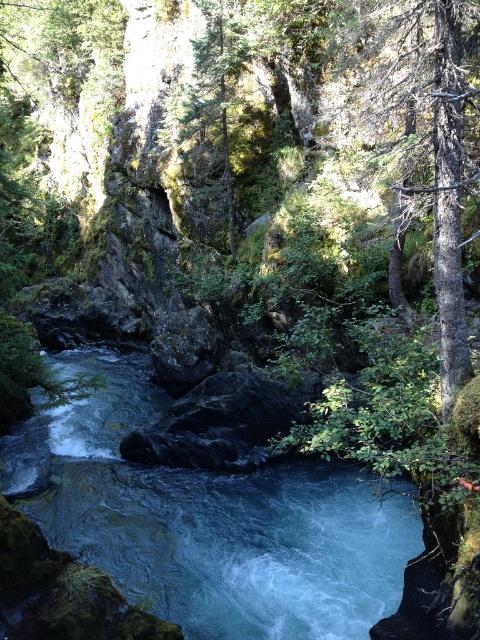
Question: Which of the following is the farthest from the observer?

Choices:
 (A) blue smooth water at center
 (B) green mossy rock at upper center
 (C) smooth bark tree at right

Answer: (B)

Question: Can you confirm if blue smooth water at center is positioned to the left of green mossy rock at upper center?

Choices:
 (A) no
 (B) yes

Answer: (B)

Question: Which object is positioned closest to the green mossy rock at upper center?

Choices:
 (A) smooth bark tree at right
 (B) blue smooth water at center

Answer: (A)

Question: Is blue smooth water at center thinner than green mossy rock at upper center?

Choices:
 (A) yes
 (B) no

Answer: (B)

Question: Is blue smooth water at center to the right of smooth bark tree at right from the viewer's perspective?

Choices:
 (A) yes
 (B) no

Answer: (B)

Question: Which of these objects is positioned closest to the green mossy rock at upper center?

Choices:
 (A) smooth bark tree at right
 (B) blue smooth water at center

Answer: (A)